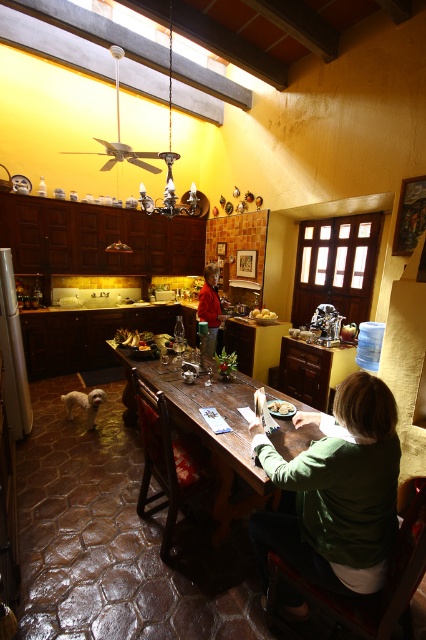
Which is below, smooth brown bread at table center or yellow matte potatoes at center?

smooth brown bread at table center

Is point (276, 401) behind point (271, 317)?

No, (276, 401) is in front of (271, 317).

Where is `smooth brown bread at table center`? The image size is (426, 640). smooth brown bread at table center is located at coordinates (281, 408).

Between point (379, 412) and point (204, 310), which one is positioned behind?

Positioned behind is point (204, 310).

This screenshot has width=426, height=640. Identify the location of green cotton shirt at center. (336, 492).

Locate an element on the screen. This screenshot has height=640, width=426. green cotton shirt at center is located at coordinates (336, 492).

Does green cotton shirt at center appear over yellow matte potatoes at center?

Incorrect, green cotton shirt at center is not positioned above yellow matte potatoes at center.

Which is behind, point (351, 504) or point (267, 310)?

Point (267, 310)

The width and height of the screenshot is (426, 640). Find the location of `green cotton shirt at center`. green cotton shirt at center is located at coordinates (336, 492).